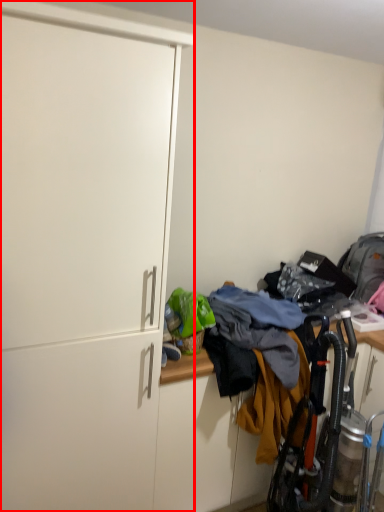
Question: Observing the image, what is the correct spatial positioning of cabinetry (annotated by the red box) in reference to laundry?

Choices:
 (A) left
 (B) right

Answer: (A)